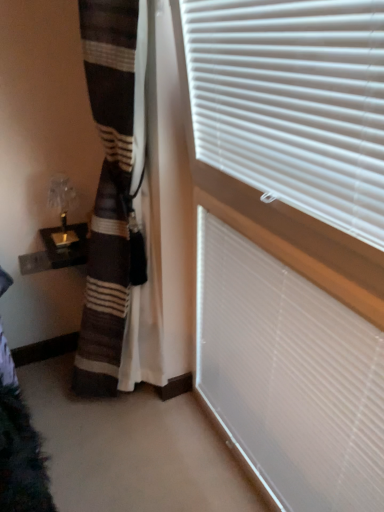
Image resolution: width=384 pixels, height=512 pixels. What do you see at coordinates (289, 376) in the screenshot?
I see `white matte window blind at upper right, which is counted as the 2th window blind, starting from the top` at bounding box center [289, 376].

You are a GUI agent. You are given a task and a screenshot of the screen. Output one action in this format:
    pyautogui.click(x=<x>, y=<y>)
    Task: Click on the white matte window blind at upper right, which is counted as the 2th window blind, starting from the top
    
    Given the screenshot: What is the action you would take?
    pyautogui.click(x=289, y=376)

The width and height of the screenshot is (384, 512). What do you see at coordinates (293, 102) in the screenshot?
I see `white plastic blinds at upper right, which ranks as the 1th window blind in top-to-bottom order` at bounding box center [293, 102].

In order to click on white plastic blinds at upper right, acting as the second window blind starting from the bottom in this screenshot , I will do `click(293, 102)`.

How much space does white plastic blinds at upper right, acting as the second window blind starting from the bottom, occupy horizontally?

It is 3.27 inches.

Where is `white matte window blind at upper right, positioned as the first window blind in bottom-to-top order`? This screenshot has height=512, width=384. white matte window blind at upper right, positioned as the first window blind in bottom-to-top order is located at coordinates (289, 376).

Is white plastic blinds at upper right, which ranks as the 1th window blind in top-to-bottom order, to the left or to the right of white matte window blind at upper right, which is counted as the 2th window blind, starting from the top, in the image?

Clearly, white plastic blinds at upper right, which ranks as the 1th window blind in top-to-bottom order, is on the left of white matte window blind at upper right, which is counted as the 2th window blind, starting from the top, in the image.

Is white plastic blinds at upper right, which ranks as the 1th window blind in top-to-bottom order, positioned in front of white matte window blind at upper right, which is counted as the 2th window blind, starting from the top?

Yes, it is in front of white matte window blind at upper right, which is counted as the 2th window blind, starting from the top.

Does point (211, 164) come behind point (362, 472)?

Yes, it is behind point (362, 472).

From the image's perspective, between white plastic blinds at upper right, acting as the second window blind starting from the bottom, and white matte window blind at upper right, positioned as the first window blind in bottom-to-top order, who is located below?

From the image's view, white matte window blind at upper right, positioned as the first window blind in bottom-to-top order, is below.

From a real-world perspective, is white plastic blinds at upper right, which ranks as the 1th window blind in top-to-bottom order, above or below white matte window blind at upper right, which is counted as the 2th window blind, starting from the top?

In terms of real-world spatial position, white plastic blinds at upper right, which ranks as the 1th window blind in top-to-bottom order, is above white matte window blind at upper right, which is counted as the 2th window blind, starting from the top.

Is white plastic blinds at upper right, which ranks as the 1th window blind in top-to-bottom order, wider than white matte window blind at upper right, positioned as the first window blind in bottom-to-top order?

Yes.

Does white plastic blinds at upper right, acting as the second window blind starting from the bottom, have a lesser height compared to white matte window blind at upper right, which is counted as the 2th window blind, starting from the top?

Yes, white plastic blinds at upper right, acting as the second window blind starting from the bottom, is shorter than white matte window blind at upper right, which is counted as the 2th window blind, starting from the top.

Between white plastic blinds at upper right, acting as the second window blind starting from the bottom, and white matte window blind at upper right, positioned as the first window blind in bottom-to-top order, which one has larger size?

white plastic blinds at upper right, acting as the second window blind starting from the bottom, is bigger.

Is white plastic blinds at upper right, acting as the second window blind starting from the bottom, positioned beyond the bounds of white matte window blind at upper right, which is counted as the 2th window blind, starting from the top?

white plastic blinds at upper right, acting as the second window blind starting from the bottom, is positioned outside white matte window blind at upper right, which is counted as the 2th window blind, starting from the top.

Does white plastic blinds at upper right, which ranks as the 1th window blind in top-to-bottom order, touch white matte window blind at upper right, which is counted as the 2th window blind, starting from the top?

No, white plastic blinds at upper right, which ranks as the 1th window blind in top-to-bottom order, is not touching white matte window blind at upper right, which is counted as the 2th window blind, starting from the top.

Is white matte window blind at upper right, which is counted as the 2th window blind, starting from the top, at the back of white plastic blinds at upper right, which ranks as the 1th window blind in top-to-bottom order?

white plastic blinds at upper right, which ranks as the 1th window blind in top-to-bottom order, does not have its back to white matte window blind at upper right, which is counted as the 2th window blind, starting from the top.

How distant is white plastic blinds at upper right, which ranks as the 1th window blind in top-to-bottom order, from white matte window blind at upper right, positioned as the first window blind in bottom-to-top order?

white plastic blinds at upper right, which ranks as the 1th window blind in top-to-bottom order, is 17.07 inches from white matte window blind at upper right, positioned as the first window blind in bottom-to-top order.

This screenshot has width=384, height=512. In order to click on window blind on the left of white matte window blind at upper right, which is counted as the 2th window blind, starting from the top in this screenshot , I will do `click(293, 102)`.

Considering the relative positions of white matte window blind at upper right, positioned as the first window blind in bottom-to-top order, and white plastic blinds at upper right, acting as the second window blind starting from the bottom, in the image provided, is white matte window blind at upper right, positioned as the first window blind in bottom-to-top order, to the left or to the right of white plastic blinds at upper right, acting as the second window blind starting from the bottom,?

Based on their positions, white matte window blind at upper right, positioned as the first window blind in bottom-to-top order, is located to the right of white plastic blinds at upper right, acting as the second window blind starting from the bottom.

Which is behind, white matte window blind at upper right, positioned as the first window blind in bottom-to-top order, or white plastic blinds at upper right, which ranks as the 1th window blind in top-to-bottom order?

white matte window blind at upper right, positioned as the first window blind in bottom-to-top order, is behind.

Does point (324, 361) appear closer or farther from the camera than point (230, 78)?

Point (324, 361) is positioned farther from the camera compared to point (230, 78).

From the image's perspective, which is below, white matte window blind at upper right, positioned as the first window blind in bottom-to-top order, or white plastic blinds at upper right, acting as the second window blind starting from the bottom?

white matte window blind at upper right, positioned as the first window blind in bottom-to-top order.

From a real-world perspective, who is located lower, white matte window blind at upper right, positioned as the first window blind in bottom-to-top order, or white plastic blinds at upper right, which ranks as the 1th window blind in top-to-bottom order?

white matte window blind at upper right, positioned as the first window blind in bottom-to-top order, is physically lower.

Which object is thinner, white matte window blind at upper right, positioned as the first window blind in bottom-to-top order, or white plastic blinds at upper right, which ranks as the 1th window blind in top-to-bottom order?

white matte window blind at upper right, positioned as the first window blind in bottom-to-top order.

Which of these two, white matte window blind at upper right, which is counted as the 2th window blind, starting from the top, or white plastic blinds at upper right, acting as the second window blind starting from the bottom, stands shorter?

Standing shorter between the two is white plastic blinds at upper right, acting as the second window blind starting from the bottom.

Does white matte window blind at upper right, positioned as the first window blind in bottom-to-top order, have a smaller size compared to white plastic blinds at upper right, acting as the second window blind starting from the bottom?

Indeed, white matte window blind at upper right, positioned as the first window blind in bottom-to-top order, has a smaller size compared to white plastic blinds at upper right, acting as the second window blind starting from the bottom.

Is white plastic blinds at upper right, acting as the second window blind starting from the bottom, a part of white matte window blind at upper right, which is counted as the 2th window blind, starting from the top?

Actually, white plastic blinds at upper right, acting as the second window blind starting from the bottom, is outside white matte window blind at upper right, which is counted as the 2th window blind, starting from the top.

Would you say white matte window blind at upper right, positioned as the first window blind in bottom-to-top order, is a long distance from white plastic blinds at upper right, which ranks as the 1th window blind in top-to-bottom order?

No.

Could you tell me if white matte window blind at upper right, positioned as the first window blind in bottom-to-top order, is turned towards white plastic blinds at upper right, which ranks as the 1th window blind in top-to-bottom order?

No, white matte window blind at upper right, positioned as the first window blind in bottom-to-top order, does not turn towards white plastic blinds at upper right, which ranks as the 1th window blind in top-to-bottom order.

What's the angular difference between white matte window blind at upper right, which is counted as the 2th window blind, starting from the top, and white plastic blinds at upper right, acting as the second window blind starting from the bottom,'s facing directions?

They differ by 0.47 degrees in their facing directions.

The height and width of the screenshot is (512, 384). Find the location of `window blind below the white plastic blinds at upper right, acting as the second window blind starting from the bottom (from the image's perspective)`. window blind below the white plastic blinds at upper right, acting as the second window blind starting from the bottom (from the image's perspective) is located at coordinates (289, 376).

Locate an element on the screen. The width and height of the screenshot is (384, 512). window blind above the white matte window blind at upper right, positioned as the first window blind in bottom-to-top order (from the image's perspective) is located at coordinates (293, 102).

Find the location of a particular element. window blind behind the white plastic blinds at upper right, which ranks as the 1th window blind in top-to-bottom order is located at coordinates (289, 376).